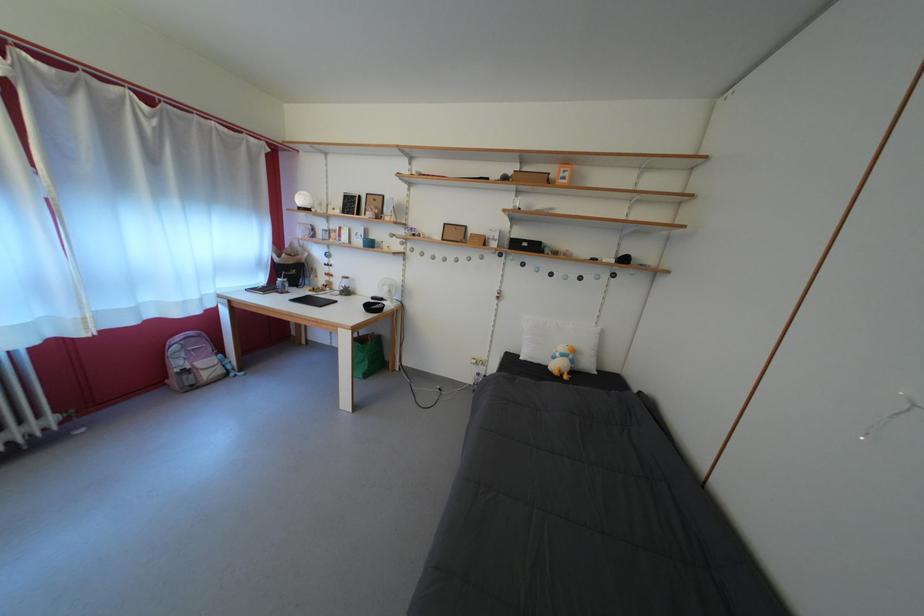
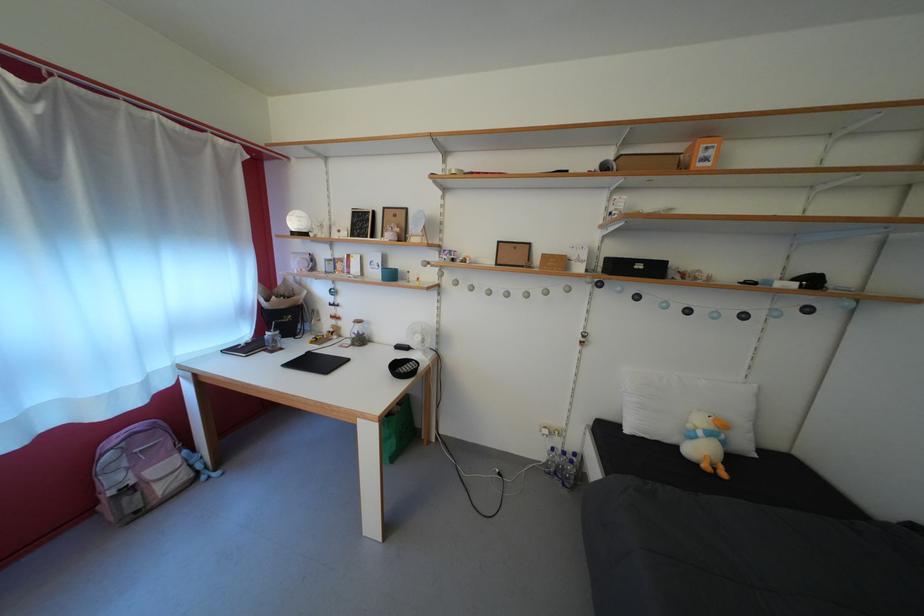
Locate, in the second image, the point that corresponds to pixel 368 248 in the first image.

(383, 280)